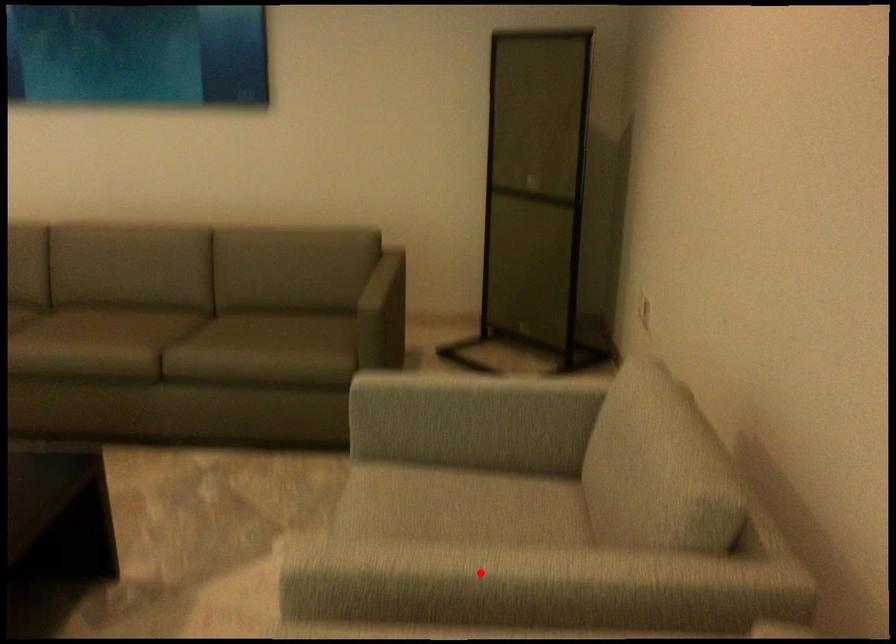
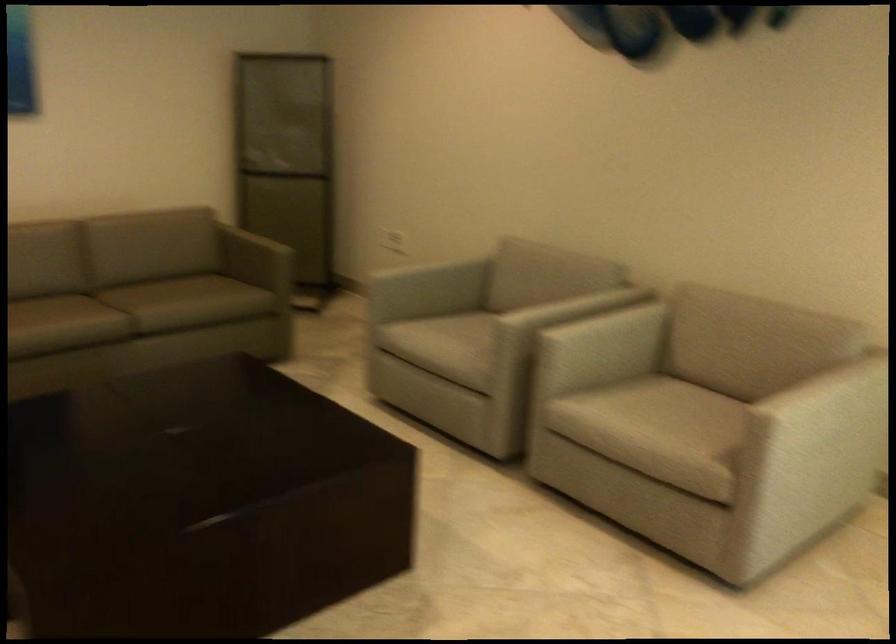
The point at the highlighted location is marked in the first image. Where is the corresponding point in the second image?

(548, 304)